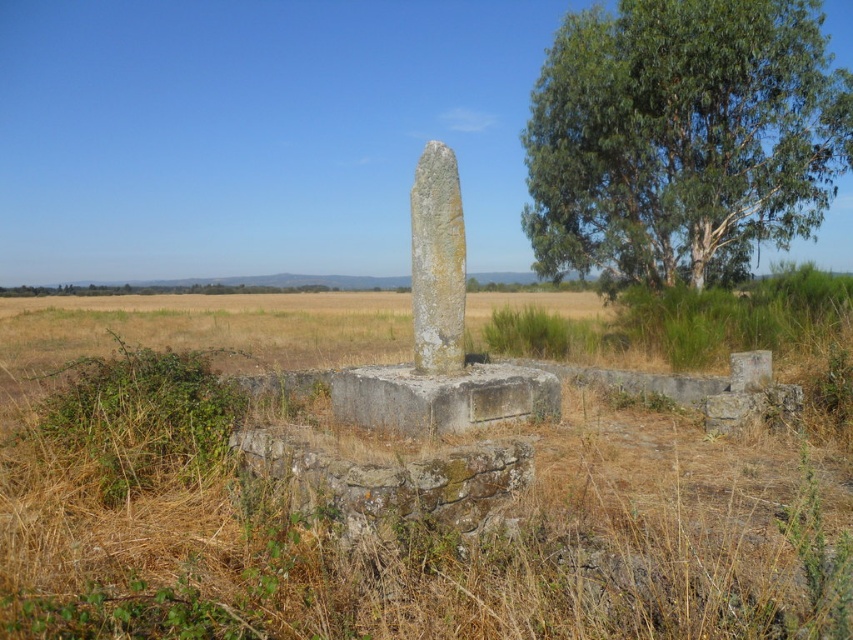
Is point (657, 108) farther from camera compared to point (432, 240)?

Yes, point (657, 108) is farther from viewer.

Image resolution: width=853 pixels, height=640 pixels. I want to click on green leafy tree at upper right, so click(682, 136).

Between brown dry grass at center and gray stone pillar at center, which one is positioned higher?

Positioned higher is gray stone pillar at center.

Who is shorter, brown dry grass at center or gray stone pillar at center?

With less height is brown dry grass at center.

Where is `brown dry grass at center`? brown dry grass at center is located at coordinates (375, 499).

Does brown dry grass at center have a smaller size compared to green leafy tree at upper right?

No.

Which is behind, point (642, 513) or point (804, 172)?

Positioned behind is point (804, 172).

At what (x,y) coordinates should I click in order to perform the action: click on brown dry grass at center. Please return your answer as a coordinate pair (x, y). This screenshot has height=640, width=853. Looking at the image, I should click on (375, 499).